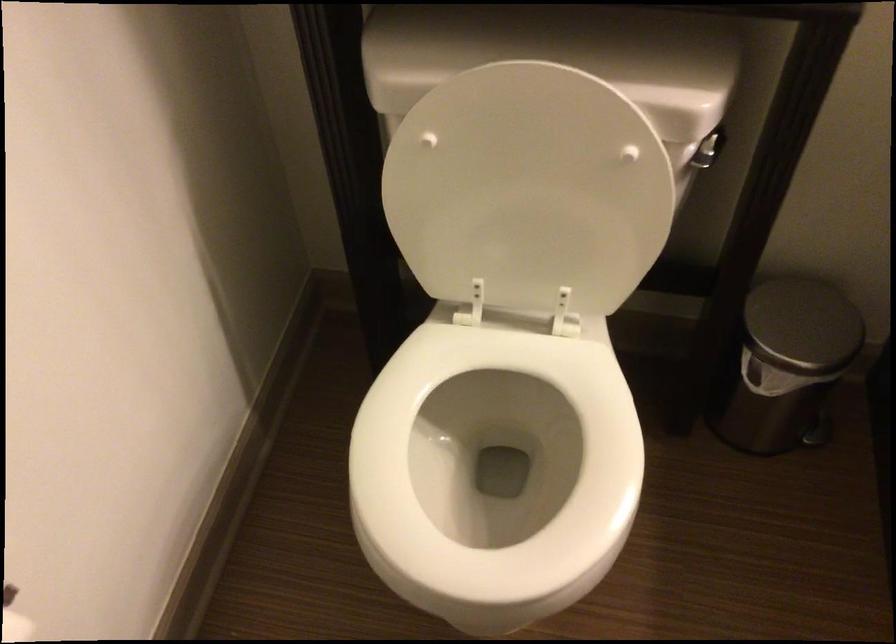
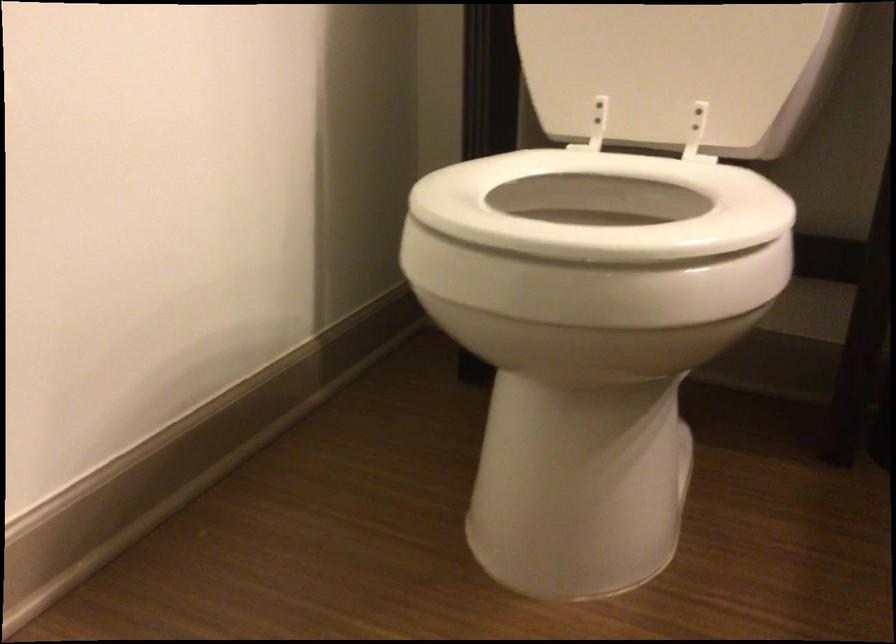
Question: How did the camera likely rotate?

Choices:
 (A) Left
 (B) Right
 (C) Up
 (D) Down

Answer: (C)